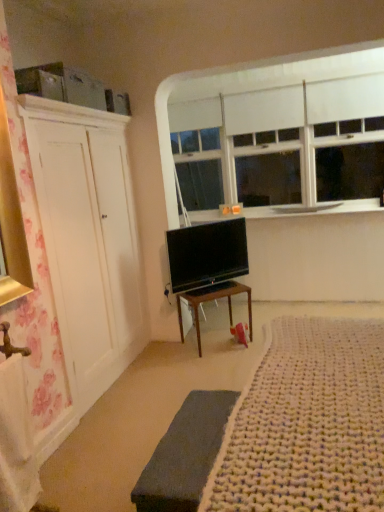
Question: Is white matte window at upper center inside the boundaries of dark gray fabric bed frame at lower center, or outside?

Choices:
 (A) inside
 (B) outside

Answer: (B)

Question: Is point (360, 104) closer or farther from the camera than point (211, 439)?

Choices:
 (A) closer
 (B) farther

Answer: (B)

Question: Which object is positioned farthest from the wooden desk at center?

Choices:
 (A) white matte window at upper center
 (B) white smooth window sill at upper center
 (C) dark gray fabric bed frame at lower center
 (D) white knitted rug at lower right
 (E) flat screen tv at center

Answer: (A)

Question: Based on their relative distances, which object is nearer to the white matte window at upper center?

Choices:
 (A) wooden desk at center
 (B) white smooth window sill at upper center
 (C) dark gray fabric bed frame at lower center
 (D) white knitted rug at lower right
 (E) flat screen tv at center

Answer: (B)